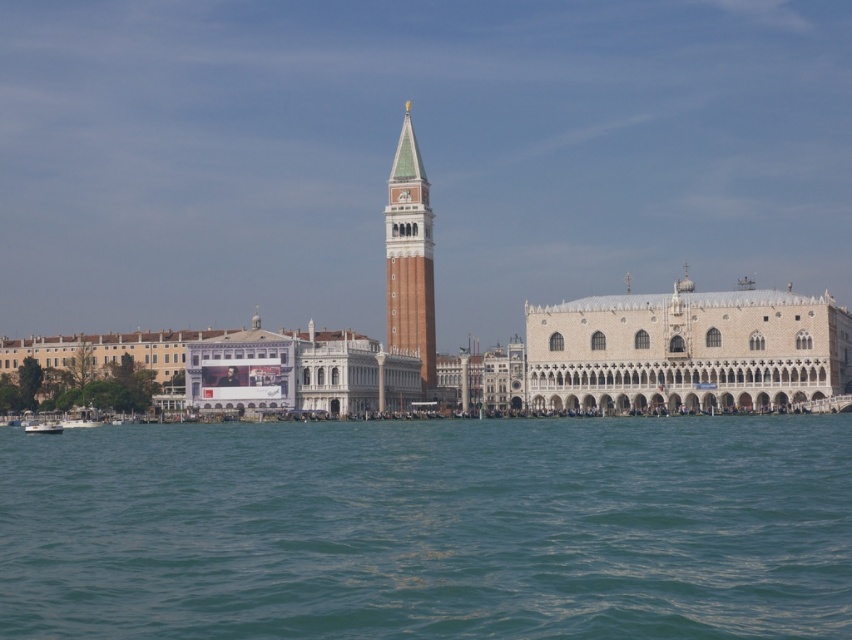
Which is in front, point (666, 298) or point (426, 385)?

Point (666, 298)

Identify the location of white stone palace at center. (686, 349).

The image size is (852, 640). What are the coordinates of `white stone palace at center` in the screenshot? It's located at (686, 349).

Does teal water at lower center appear over white glossy boat at lower left?

Yes, teal water at lower center is above white glossy boat at lower left.

Is teal water at lower center behind white glossy boat at lower left?

No, it is in front of white glossy boat at lower left.

Is point (119, 621) behind point (41, 422)?

No, it is not.

Where is `teal water at lower center`? This screenshot has width=852, height=640. teal water at lower center is located at coordinates (430, 529).

The height and width of the screenshot is (640, 852). What do you see at coordinates (686, 349) in the screenshot?
I see `white stone palace at center` at bounding box center [686, 349].

This screenshot has height=640, width=852. I want to click on white stone palace at center, so click(686, 349).

Find the location of `white stone palace at center`. white stone palace at center is located at coordinates (686, 349).